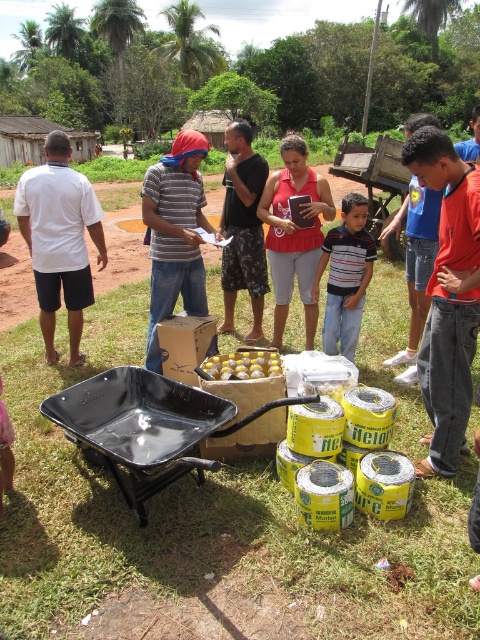
Who is more distant from viewer, (326, 333) or (372, 168)?

The point (372, 168) is more distant.

Consider the image. Which is more to the right, striped cotton shirt at center or wooden cart at center?

From the viewer's perspective, wooden cart at center appears more on the right side.

Does point (369, 275) lie in front of point (406, 173)?

Yes, it is.

The height and width of the screenshot is (640, 480). Identify the location of striped cotton shirt at center. (346, 276).

Does point (128, 371) come behind point (211, 372)?

That is True.

Between black plastic cart at center and yellow matte plastic eggs at center, which one is positioned lower?

black plastic cart at center is below.

In order to click on black plastic cart at center in this screenshot , I will do `click(146, 426)`.

Locate an element on the screen. The image size is (480, 640). black plastic cart at center is located at coordinates (146, 426).

Is point (308, 321) positioned before point (347, 330)?

No.

Looking at this image, who is positioned more to the right, matte pink tank top at center or striped cotton shirt at center?

striped cotton shirt at center is more to the right.

This screenshot has width=480, height=640. I want to click on matte pink tank top at center, so click(294, 234).